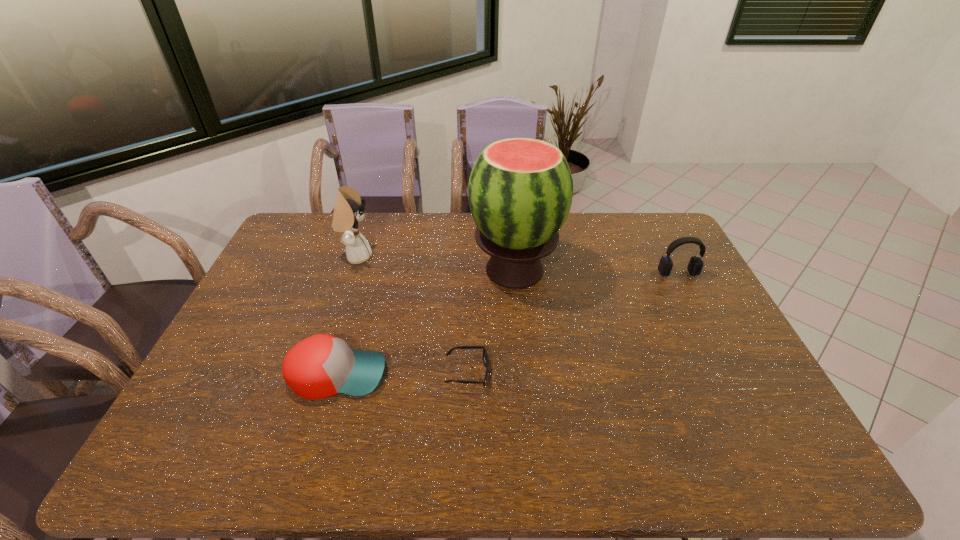
You are a GUI agent. You are given a task and a screenshot of the screen. Output one action in this format:
    pyautogui.click(x=<x>, y=<y>)
    Task: Click on the third closest object to the fourth tallest object
    The image size is (960, 540).
    Given the screenshot: What is the action you would take?
    pyautogui.click(x=348, y=211)

I want to click on free spot that satisfies the following two spatial constraints: 1. on the headband of the third shortest object; 2. on the front-facing side of the shortest object, so click(x=730, y=372).

Identify the location of blank space that satisfies the following two spatial constraints: 1. on the headband of the third tallest object; 2. at the brim of the second shortest object. This screenshot has width=960, height=540. (731, 374).

Where is `vacant area that satisfies the following two spatial constraints: 1. at the front face of the fourth shortest object; 2. on the right side of the tallest object`? vacant area that satisfies the following two spatial constraints: 1. at the front face of the fourth shortest object; 2. on the right side of the tallest object is located at coordinates (351, 270).